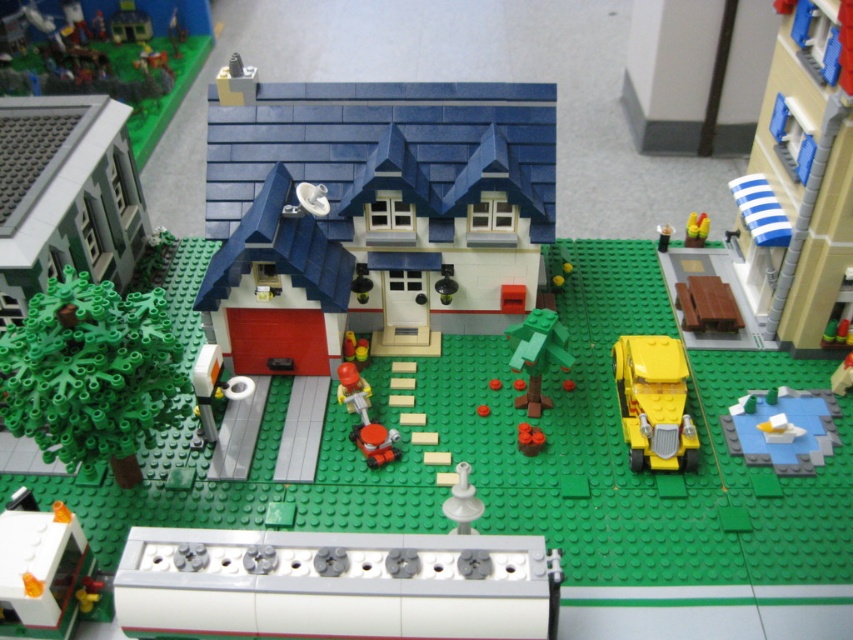
Question: Which object is closer to the camera taking this photo?

Choices:
 (A) metallic silver spoon at center
 (B) white plastic boat at lower right
 (C) green matte tree at center

Answer: (B)

Question: Is white plastic boat at lower right bigger than metallic silver spoon at center?

Choices:
 (A) no
 (B) yes

Answer: (B)

Question: Does yellow plastic car at right appear under yellow plastic car at lower right?

Choices:
 (A) no
 (B) yes

Answer: (A)

Question: Is green matte tree at lower left bigger than translucent orange plastic toy at lower left?

Choices:
 (A) no
 (B) yes

Answer: (B)

Question: Estimate the real-world distances between objects in this image. Which object is closer to the yellow plastic car at right?

Choices:
 (A) metallic silver spoon at center
 (B) white plastic boat at lower right
 (C) green matte tree at lower left
 (D) translucent orange plastic toy at lower left

Answer: (B)

Question: Which point is closer to the camera taking this photo?

Choices:
 (A) 154,340
 (B) 534,401

Answer: (A)